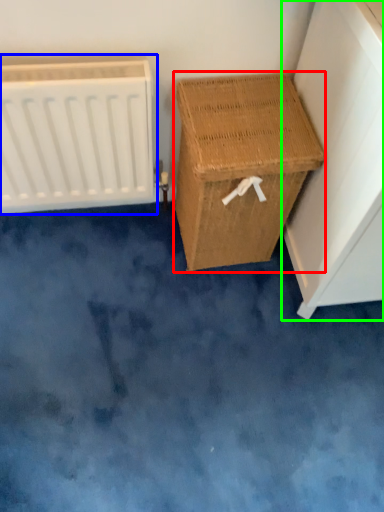
Question: Which object is the closest to the furniture (highlighted by a red box)? Choose among these: radiator (highlighted by a blue box) or furniture (highlighted by a green box).

Choices:
 (A) radiator
 (B) furniture

Answer: (B)